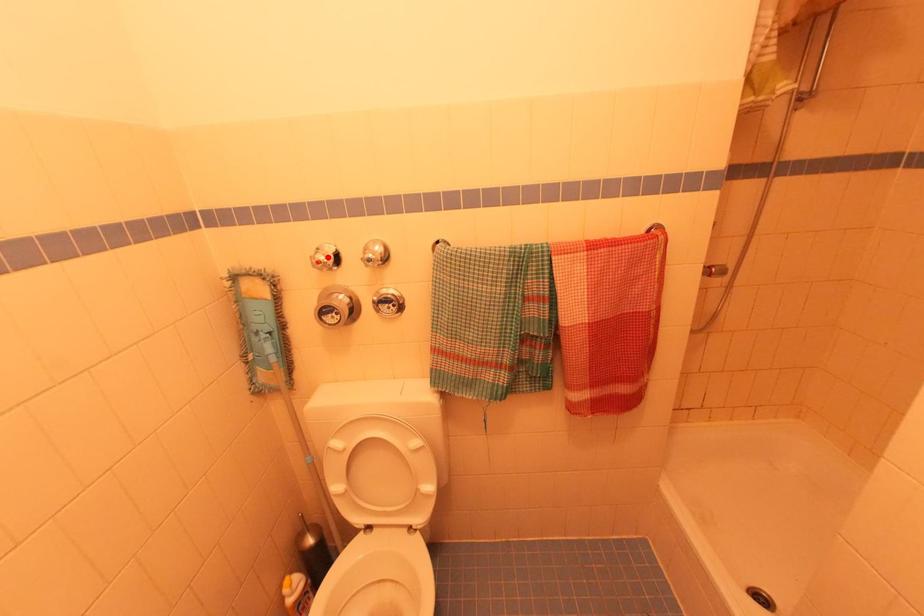
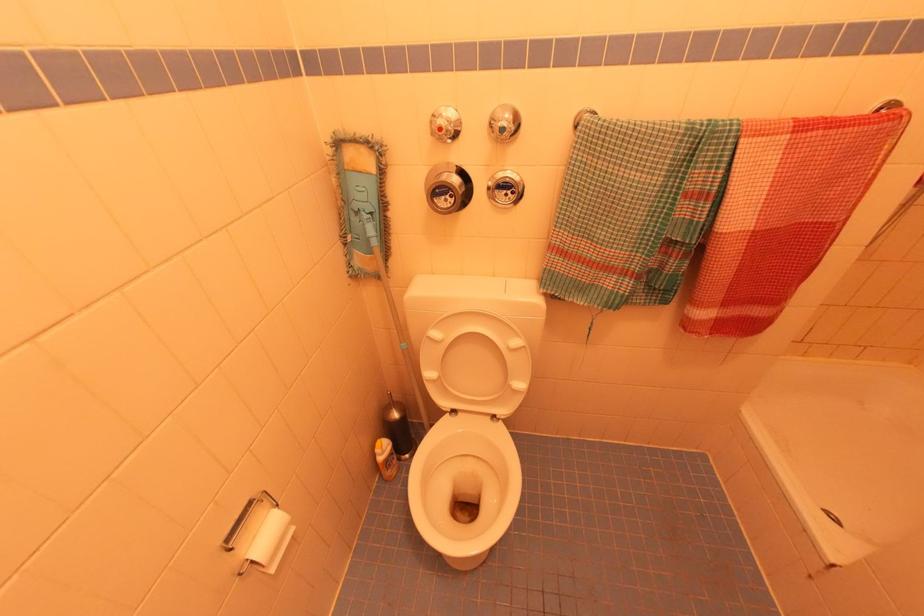
The point at the highlighted location is marked in the first image. Where is the corresponding point in the second image?

(450, 123)